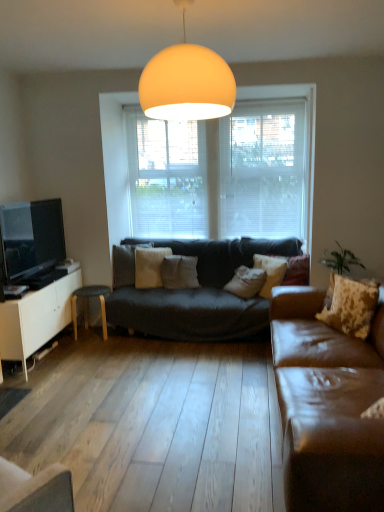
Question: Which direction should I rotate to look at white cotton pillow at center, which is the first pillow in back-to-front order?

Choices:
 (A) right
 (B) left

Answer: (B)

Question: Is white soft pillow at center, which is the third pillow in front-to-back order, to the right of matte orange globe at upper center from the viewer's perspective?

Choices:
 (A) no
 (B) yes

Answer: (A)

Question: Considering the relative sizes of white soft pillow at center, which is the fourth pillow from right to left, and matte orange globe at upper center in the image provided, is white soft pillow at center, which is the fourth pillow from right to left, smaller than matte orange globe at upper center?

Choices:
 (A) no
 (B) yes

Answer: (B)

Question: From a real-world perspective, is white soft pillow at center, which is the fourth pillow from right to left, under matte orange globe at upper center?

Choices:
 (A) no
 (B) yes

Answer: (B)

Question: Would you say matte orange globe at upper center is part of white soft pillow at center, which is the third pillow in front-to-back order,'s contents?

Choices:
 (A) no
 (B) yes

Answer: (A)

Question: Could you tell me if white soft pillow at center, which appears as the 2th pillow when viewed from the back, is facing matte orange globe at upper center?

Choices:
 (A) no
 (B) yes

Answer: (A)

Question: From the image's perspective, does white soft pillow at center, arranged as the first pillow when viewed from the left, appear higher than matte orange globe at upper center?

Choices:
 (A) yes
 (B) no

Answer: (B)

Question: Could you tell me if white blinds at center, the 2th window screen in the right-to-left sequence, is facing brown leather couch at right?

Choices:
 (A) no
 (B) yes

Answer: (A)

Question: From a real-world perspective, is white blinds at center, the first window screen positioned from the left, on brown leather couch at right?

Choices:
 (A) yes
 (B) no

Answer: (A)

Question: From the image's perspective, is white blinds at center, the first window screen positioned from the left, located beneath brown leather couch at right?

Choices:
 (A) no
 (B) yes

Answer: (A)

Question: Is white blinds at center, the first window screen positioned from the left, closer to camera compared to brown leather couch at right?

Choices:
 (A) yes
 (B) no

Answer: (B)

Question: Can you confirm if white blinds at center, the 2th window screen in the right-to-left sequence, is shorter than brown leather couch at right?

Choices:
 (A) no
 (B) yes

Answer: (A)

Question: Can you confirm if white blinds at center, the first window screen positioned from the left, is taller than brown leather couch at right?

Choices:
 (A) yes
 (B) no

Answer: (A)

Question: Is white cotton pillow at center, placed as the 4th pillow when sorted from front to back, at the left side of white matte cabinet at left?

Choices:
 (A) yes
 (B) no

Answer: (B)